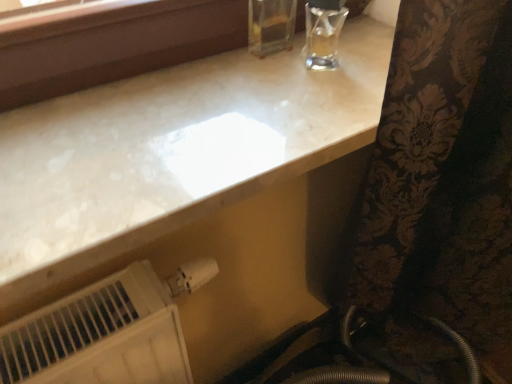
Find the location of a particular element. This screenshot has height=384, width=512. free space above white marble countertop at upper center (from a real-world perspective) is located at coordinates (226, 103).